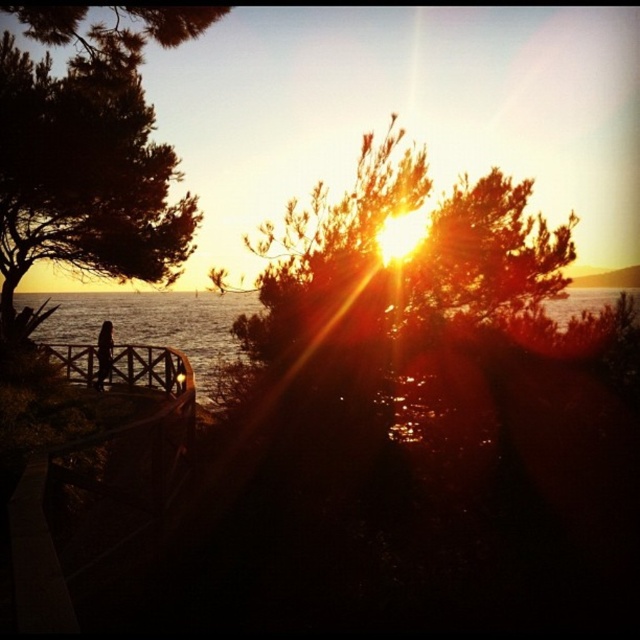
You are standing on the wooden railing leading towards the water and want to take a photo of the green leafy tree at left and the clear blue water at lower left. Which object will appear larger in your photo?

The green leafy tree at left will appear larger in your photo because it is closer to the viewer than the clear blue water at lower left.

You are a photographer trying to capture the sunset scene. You want to place the green leafy tree at left exactly at the point specified by the rule of thirds grid. Is the green leafy tree at left currently positioned correctly at point (x=88, y=150)?

The green leafy tree at left is located at point (x=88, y=150), so it is correctly positioned according to the rule of thirds grid.

You are a photographer trying to capture the sunset. You want to position yourself so that the silhouette wooden person at lower left is on the left side of your photo and the translucent water at center is centered. Is this possible given their positions?

Yes, because the translucent water at center is to the right of the silhouette wooden person at lower left, positioning yourself so the person is on the left and the water is centered would work.